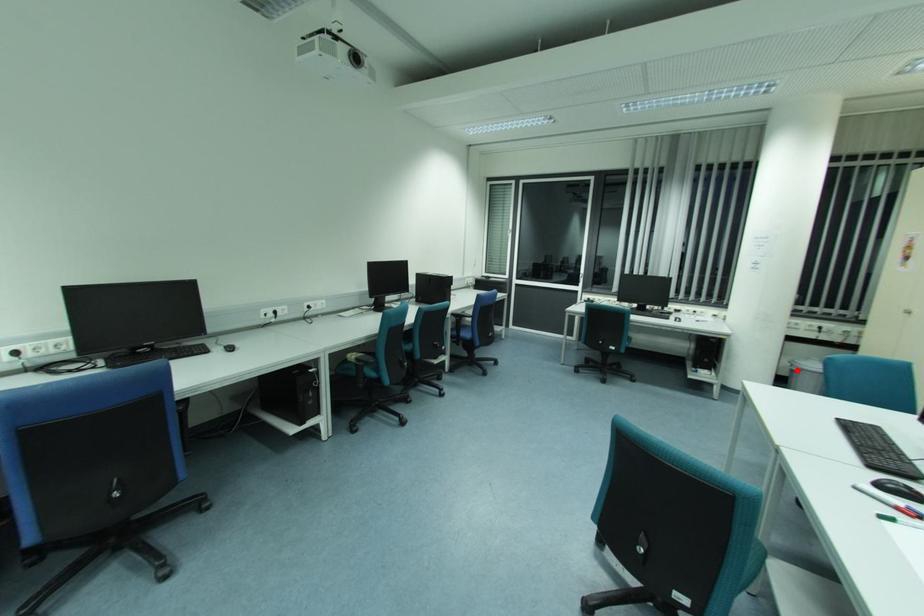
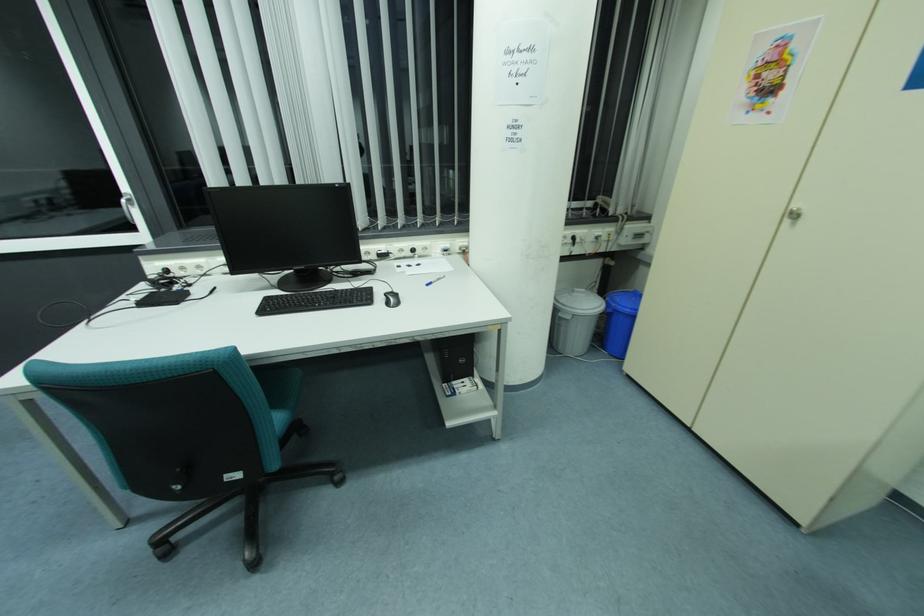
Question: I am providing you with two images of the same scene from different viewpoints. A red point is shown in image1. For the corresponding object point in image2, is it positioned nearer or farther from the camera?

Choices:
 (A) Nearer
 (B) Farther

Answer: (A)